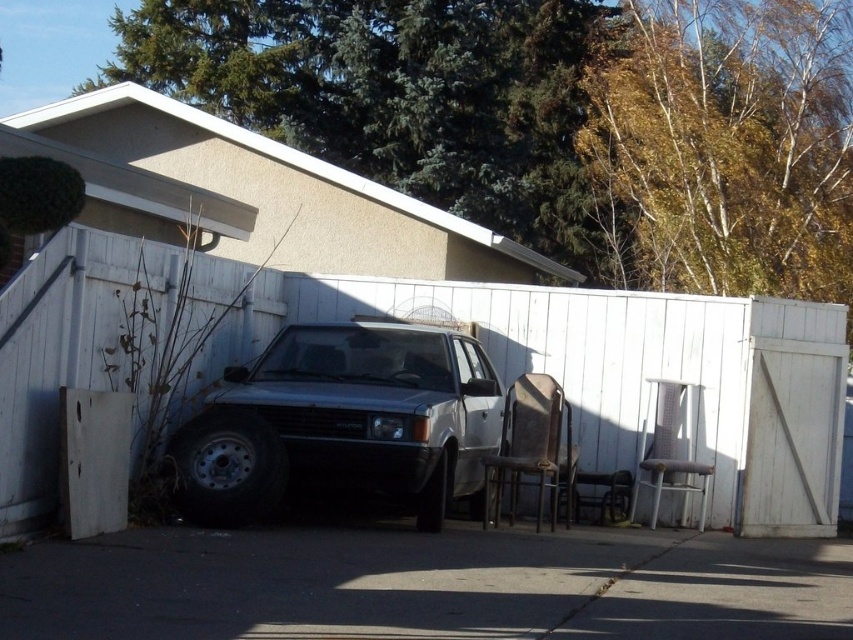
Is dark asphalt driveway at center positioned in front of satin silver car at center?

Yes.

Who is shorter, dark asphalt driveway at center or satin silver car at center?

Standing shorter between the two is dark asphalt driveway at center.

Between point (538, 573) and point (500, 432), which one is positioned in front?

Point (538, 573) is in front.

Locate an element on the screen. Image resolution: width=853 pixels, height=640 pixels. dark asphalt driveway at center is located at coordinates (426, 586).